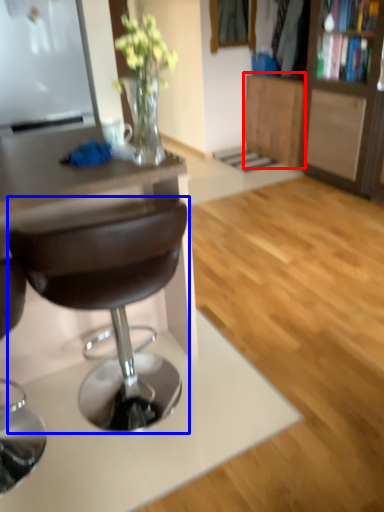
Question: Among these objects, which one is nearest to the camera, cabinetry (highlighted by a red box) or chair (highlighted by a blue box)?

Choices:
 (A) cabinetry
 (B) chair

Answer: (B)